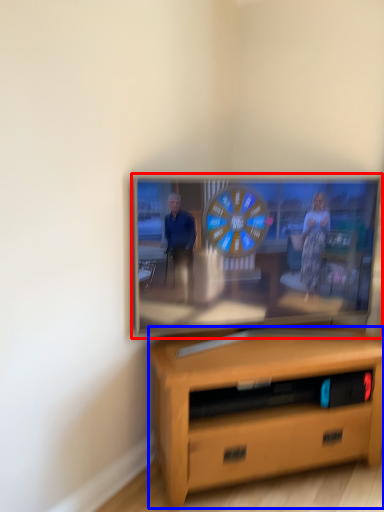
Question: Among these objects, which one is farthest to the camera, television (highlighted by a red box) or desk (highlighted by a blue box)?

Choices:
 (A) television
 (B) desk

Answer: (A)